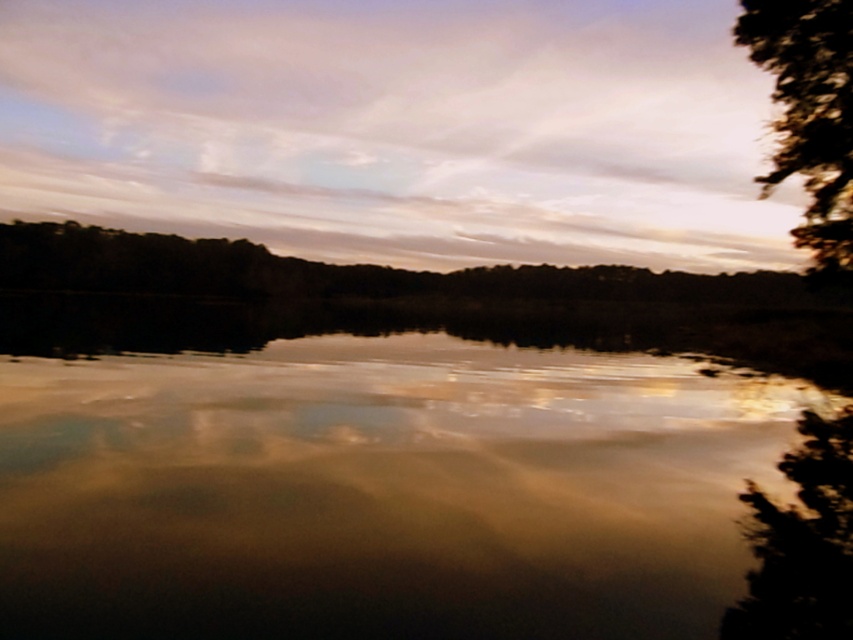
Can you confirm if brown reflective water at center is positioned above brown matte tree at center?

No, brown reflective water at center is not above brown matte tree at center.

Who is more forward, (x=194, y=451) or (x=607, y=298)?

Positioned in front is point (x=194, y=451).

Between point (340, 337) and point (202, 243), which one is positioned in front?

Point (340, 337) is in front.

Locate an element on the screen. This screenshot has width=853, height=640. brown reflective water at center is located at coordinates (368, 474).

Is dark green textured tree at right closer to the viewer compared to green leafy tree at right?

No, dark green textured tree at right is further to the viewer.

Which of these two, dark green textured tree at right or green leafy tree at right, stands taller?

With more height is dark green textured tree at right.

Who is more forward, (840, 134) or (831, 522)?

Positioned in front is point (831, 522).

The image size is (853, 640). Identify the location of dark green textured tree at right. (809, 113).

Can you confirm if brown reflective water at center is thinner than cloudy sky at upper center?

Yes, brown reflective water at center is thinner than cloudy sky at upper center.

Does brown reflective water at center appear over cloudy sky at upper center?

No, brown reflective water at center is not above cloudy sky at upper center.

Measure the distance between point [38,440] and camera.

Point [38,440] and camera are 10.09 meters apart.

This screenshot has width=853, height=640. Find the location of `brown reflective water at center`. brown reflective water at center is located at coordinates (368, 474).